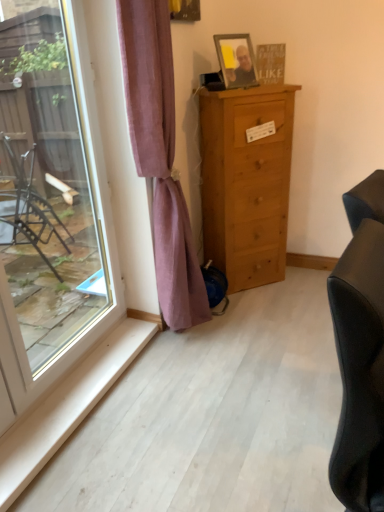
The height and width of the screenshot is (512, 384). In order to click on purple velvet curtain at center in this screenshot , I will do `click(160, 157)`.

This screenshot has height=512, width=384. What do you see at coordinates (160, 157) in the screenshot? I see `purple velvet curtain at center` at bounding box center [160, 157].

The height and width of the screenshot is (512, 384). What do you see at coordinates (246, 182) in the screenshot? I see `light brown wood chest of drawers at center` at bounding box center [246, 182].

Locate an element on the screen. This screenshot has height=512, width=384. transparent glass window at left is located at coordinates (50, 203).

This screenshot has width=384, height=512. Find the location of `black leather studio couch at right`. black leather studio couch at right is located at coordinates (360, 351).

Relative to wooden framed photo at upper center, is transparent glass window at left in front or behind?

transparent glass window at left is positioned closer to the viewer than wooden framed photo at upper center.

From the image's perspective, is transparent glass window at left above wooden framed photo at upper center?

No, from the image's perspective, transparent glass window at left is not above wooden framed photo at upper center.

Could you tell me if transparent glass window at left is facing wooden framed photo at upper center?

No.

Are transparent glass window at left and wooden framed photo at upper center beside each other?

transparent glass window at left and wooden framed photo at upper center are clearly separated.

Is black leather studio couch at right shorter than wooden framed photo at upper center?

No, black leather studio couch at right is not shorter than wooden framed photo at upper center.

Is black leather studio couch at right positioned with its back to wooden framed photo at upper center?

No, black leather studio couch at right's orientation is not away from wooden framed photo at upper center.

In the image, is black leather studio couch at right positioned in front of or behind wooden framed photo at upper center?

black leather studio couch at right is in front of wooden framed photo at upper center.

How many degrees apart are the facing directions of black leather studio couch at right and wooden framed photo at upper center?

There is a 22.2-degree angle between the facing directions of black leather studio couch at right and wooden framed photo at upper center.

Is purple velvet curtain at center far from transparent glass window at left?

purple velvet curtain at center is actually quite close to transparent glass window at left.

Is purple velvet curtain at center to the left of transparent glass window at left from the viewer's perspective?

Incorrect, purple velvet curtain at center is not on the left side of transparent glass window at left.

Is purple velvet curtain at center shorter than transparent glass window at left?

No, purple velvet curtain at center is not shorter than transparent glass window at left.

Between purple velvet curtain at center and black leather studio couch at right, which one appears on the right side from the viewer's perspective?

black leather studio couch at right.

Is purple velvet curtain at center bigger or smaller than black leather studio couch at right?

In the image, purple velvet curtain at center appears to be larger than black leather studio couch at right.

From the image's perspective, is purple velvet curtain at center positioned above or below black leather studio couch at right?

purple velvet curtain at center is situated higher than black leather studio couch at right in the image.

From a real-world perspective, is purple velvet curtain at center located beneath black leather studio couch at right?

No, from a real-world perspective, purple velvet curtain at center is not below black leather studio couch at right.

Can you confirm if wooden framed photo at upper center is thinner than transparent glass window at left?

Incorrect, the width of wooden framed photo at upper center is not less than that of transparent glass window at left.

Based on their sizes in the image, would you say wooden framed photo at upper center is bigger or smaller than transparent glass window at left?

Considering their sizes, wooden framed photo at upper center takes up less space than transparent glass window at left.

Considering the relative positions of wooden framed photo at upper center and transparent glass window at left in the image provided, is wooden framed photo at upper center behind transparent glass window at left?

Yes, it is behind transparent glass window at left.

Is transparent glass window at left located within wooden framed photo at upper center?

That's incorrect, transparent glass window at left is not inside wooden framed photo at upper center.

Is black leather studio couch at right spatially inside transparent glass window at left, or outside of it?

black leather studio couch at right is outside transparent glass window at left.

In the scene shown: From the image's perspective, which one is positioned higher, black leather studio couch at right or transparent glass window at left?

From the image's view, transparent glass window at left is above.

From a real-world perspective, which is physically above, black leather studio couch at right or transparent glass window at left?

transparent glass window at left.

Find the location of a particular element. studio couch on the right of transparent glass window at left is located at coordinates 360,351.

The image size is (384, 512). I want to click on chest of drawers above the black leather studio couch at right (from the image's perspective), so click(246, 182).

Considering the sizes of black leather studio couch at right and light brown wood chest of drawers at center in the image, is black leather studio couch at right wider or thinner than light brown wood chest of drawers at center?

In the image, black leather studio couch at right appears to be more narrow than light brown wood chest of drawers at center.

From a real-world perspective, is black leather studio couch at right positioned over light brown wood chest of drawers at center based on gravity?

No, from a real-world perspective, black leather studio couch at right is not above light brown wood chest of drawers at center.

Between black leather studio couch at right and light brown wood chest of drawers at center, which one has more height?

With more height is light brown wood chest of drawers at center.

In the image, there is a transparent glass window at left. Where is `picture frame above it (from the image's perspective)`? The height and width of the screenshot is (512, 384). picture frame above it (from the image's perspective) is located at coordinates (236, 60).

Locate an element on the screen. Image resolution: width=384 pixels, height=512 pixels. studio couch below the wooden framed photo at upper center (from the image's perspective) is located at coordinates (360, 351).

Which object lies nearer to the anchor point transparent glass window at left, wooden framed photo at upper center or light brown wood chest of drawers at center?

light brown wood chest of drawers at center.

Looking at this image, looking at the image, which one is located further to transparent glass window at left, black leather studio couch at right or purple velvet curtain at center?

black leather studio couch at right.

Looking at the image, which one is located closer to purple velvet curtain at center, transparent glass window at left or light brown wood chest of drawers at center?

light brown wood chest of drawers at center is closer to purple velvet curtain at center.

Estimate the real-world distances between objects in this image. Which object is further from purple velvet curtain at center, light brown wood chest of drawers at center or black leather studio couch at right?

Based on the image, black leather studio couch at right appears to be further to purple velvet curtain at center.

When comparing their distances from transparent glass window at left, does purple velvet curtain at center or black leather studio couch at right seem further?

black leather studio couch at right is further to transparent glass window at left.

Considering their positions, is transparent glass window at left positioned further to wooden framed photo at upper center than light brown wood chest of drawers at center?

Among the two, transparent glass window at left is located further to wooden framed photo at upper center.

Based on their spatial positions, is wooden framed photo at upper center or purple velvet curtain at center further from transparent glass window at left?

wooden framed photo at upper center is positioned further to the anchor transparent glass window at left.

Based on their spatial positions, is light brown wood chest of drawers at center or wooden framed photo at upper center closer to black leather studio couch at right?

light brown wood chest of drawers at center is closer to black leather studio couch at right.

Locate an element on the screen. chest of drawers between wooden framed photo at upper center and purple velvet curtain at center from top to bottom is located at coordinates (246, 182).

This screenshot has height=512, width=384. I want to click on picture frame situated between transparent glass window at left and black leather studio couch at right from left to right, so click(236, 60).

Find the location of `curtain between transparent glass window at left and wooden framed photo at upper center along the z-axis`. curtain between transparent glass window at left and wooden framed photo at upper center along the z-axis is located at coordinates (160, 157).

Identify the location of chest of drawers between transparent glass window at left and wooden framed photo at upper center along the z-axis. The height and width of the screenshot is (512, 384). (246, 182).